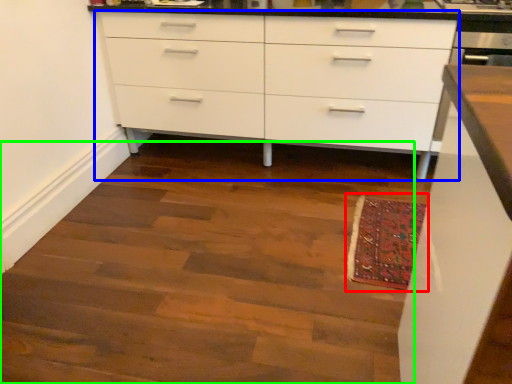
Question: Which is nearer to the mat (highlighted by a red box)? chest of drawers (highlighted by a blue box) or stairwell (highlighted by a green box).

Choices:
 (A) chest of drawers
 (B) stairwell

Answer: (B)